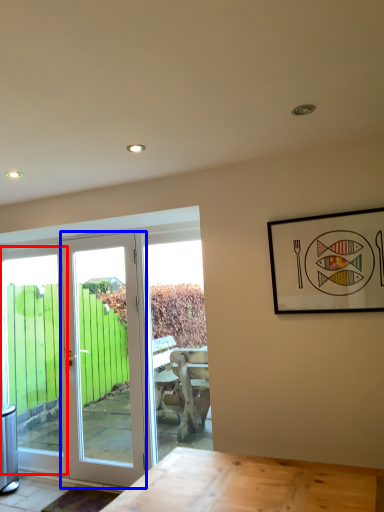
Question: Which object is further to the camera taking this photo, window (highlighted by a red box) or door (highlighted by a blue box)?

Choices:
 (A) window
 (B) door

Answer: (A)